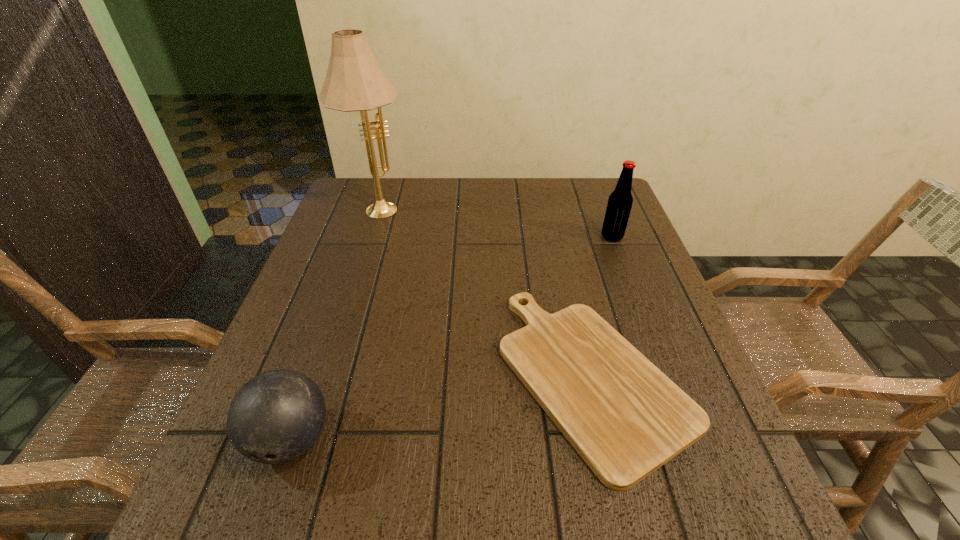
Locate an element on the screen. vacant space that's between the second shortest object and the farthest object is located at coordinates (334, 323).

Find the location of `free spot between the shortest object and the second tallest object`. free spot between the shortest object and the second tallest object is located at coordinates (603, 307).

Find the location of `vacant space that is in between the tallest object and the second shortest object`. vacant space that is in between the tallest object and the second shortest object is located at coordinates (334, 323).

You are a GUI agent. You are given a task and a screenshot of the screen. Output one action in this format:
    pyautogui.click(x=<x>, y=<y>)
    Task: Click on the unoccupied position between the bowling ball and the third shortest object
    This screenshot has width=960, height=540.
    Given the screenshot: What is the action you would take?
    pyautogui.click(x=451, y=338)

The width and height of the screenshot is (960, 540). Find the location of `unoccupied area between the second tallest object and the bowling ball`. unoccupied area between the second tallest object and the bowling ball is located at coordinates (451, 338).

At what (x,y) coordinates should I click in order to perform the action: click on free area in between the shortest object and the third tallest object. Please return your answer as a coordinate pair (x, y). This screenshot has width=960, height=540. Looking at the image, I should click on (442, 408).

Identify which object is located as the third nearest to the second tallest object. Please provide its 2D coordinates. Your answer should be formatted as a tuple, i.e. [(x, y)], where the tuple contains the x and y coordinates of a point satisfying the conditions above.

[(275, 417)]

Select which object is the closest to the second shortest object. Please provide its 2D coordinates. Your answer should be formatted as a tuple, i.e. [(x, y)], where the tuple contains the x and y coordinates of a point satisfying the conditions above.

[(626, 418)]

Find the location of a particular element. The image size is (960, 540). vacant point that satisfies the following two spatial constraints: 1. on the front side of the beer bottle; 2. on the right side of the lampshade is located at coordinates (368, 237).

At what (x,y) coordinates should I click in order to perform the action: click on blank area in the image that satisfies the following two spatial constraints: 1. on the front side of the second tallest object; 2. on the right side of the tallest object. Please return your answer as a coordinate pair (x, y). The height and width of the screenshot is (540, 960). Looking at the image, I should click on click(x=368, y=237).